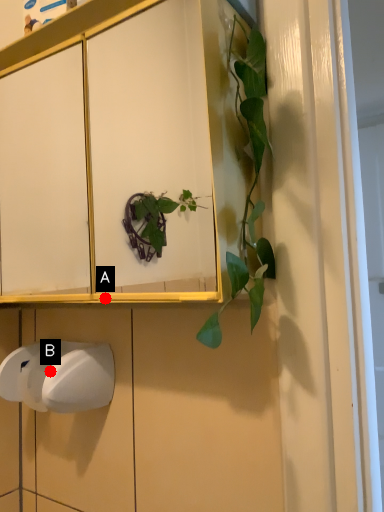
Question: Two points are circled on the image, labeled by A and B beside each circle. Which of the following is the farthest from the observer?

Choices:
 (A) A is further
 (B) B is further

Answer: (A)